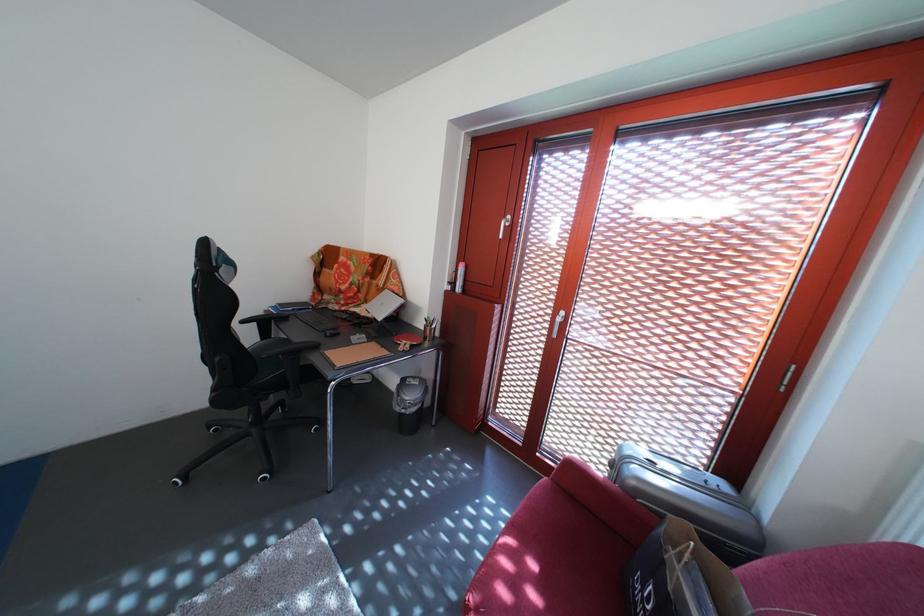
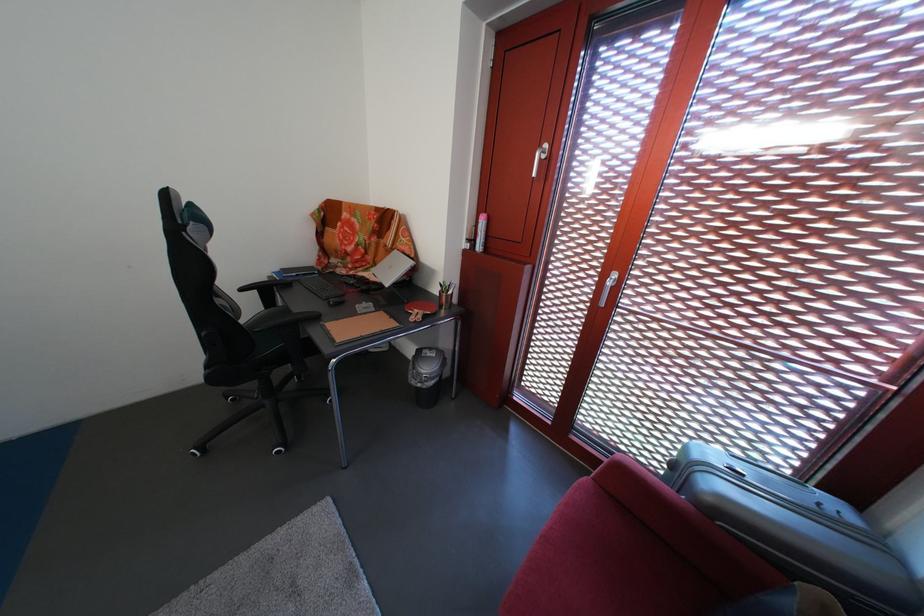
Find the pixel in the second image that matches [623,471] in the first image.

(684, 472)